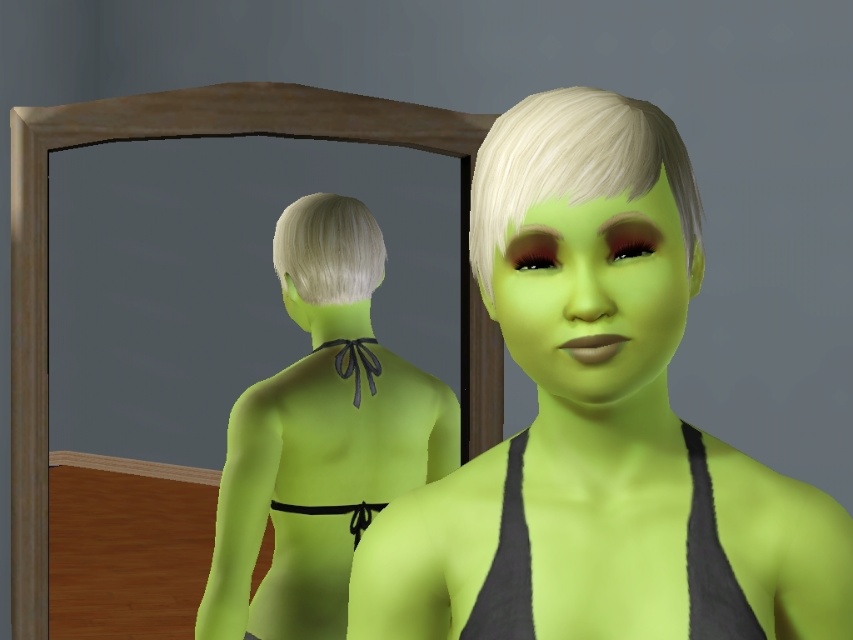
Consider the image. You are standing in front of the mirror and want to touch the point at coordinates point (300,208) on the mirror. If your arm can reach up to 8 feet, will you be able to reach it?

The distance of point (300,208) from viewer is 9.02 feet, so you cannot reach it with an arm that can only extend up to 8 feet.

You are an artist creating a portrait of the character in the image. You need to ensure the proportions of the lime matte skin at center and the blonde silky hair at back are accurate. Which object should you make larger in your drawing?

The lime matte skin at center should be made larger than the blonde silky hair at back because it has a larger size compared to the blonde silky hair at back according to the description.